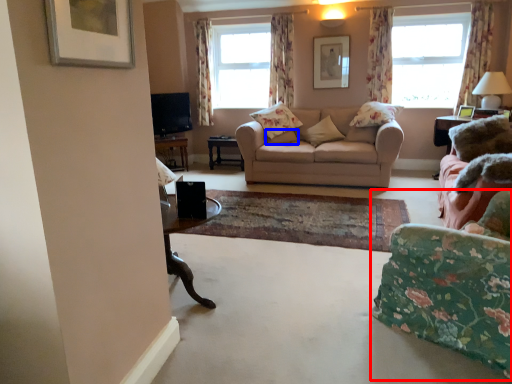
Question: Which of the following is the farthest to the observer, chair (highlighted by a red box) or pillow (highlighted by a blue box)?

Choices:
 (A) chair
 (B) pillow

Answer: (B)